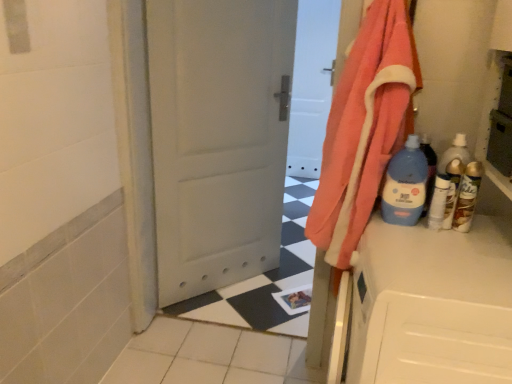
What do you see at coordinates (452, 190) in the screenshot? I see `clear plastic bottle at right, which is the second bottle in right-to-left order` at bounding box center [452, 190].

You are a GUI agent. You are given a task and a screenshot of the screen. Output one action in this format:
    pyautogui.click(x=<x>, y=<y>)
    Task: Click on the white glossy bottle at right, arranged as the 3th bottle when viewed from the right
    Image resolution: width=512 pixels, height=384 pixels.
    Given the screenshot: What is the action you would take?
    pyautogui.click(x=438, y=202)

The height and width of the screenshot is (384, 512). Identify the location of blue plastic bottle at right, placed as the 1th bottle when sorted from left to right. (405, 185).

This screenshot has width=512, height=384. Describe the element at coordinates (364, 128) in the screenshot. I see `orange cotton towel at right` at that location.

Find the location of a particular element. white matte counter top at right is located at coordinates (431, 305).

Image resolution: width=512 pixels, height=384 pixels. What do you see at coordinates (431, 305) in the screenshot?
I see `white matte counter top at right` at bounding box center [431, 305].

Locate an element on the screen. clear plastic bottle at right, which is the second bottle in right-to-left order is located at coordinates (452, 190).

Considering the relative sizes of orange cotton towel at right and clear plastic bottle at right, which is the second bottle in right-to-left order, in the image provided, is orange cotton towel at right taller than clear plastic bottle at right, which is the second bottle in right-to-left order,?

Yes.

From the picture: From the image's perspective, is orange cotton towel at right located beneath clear plastic bottle at right, the third bottle positioned from the left?

Actually, orange cotton towel at right appears above clear plastic bottle at right, the third bottle positioned from the left, in the image.

Is orange cotton towel at right bigger than clear plastic bottle at right, which is the second bottle in right-to-left order?

Yes.

What are the coordinates of `the 1st bottle positioned above the orange cotton towel at right (from a real-world perspective)` in the screenshot? It's located at (467, 196).

Which object is wider, orange cotton towel at right or gold metallic spray can at right, placed as the first bottle when sorted from right to left?

orange cotton towel at right is wider.

Considering the points (399, 72) and (455, 211), which point is behind, point (399, 72) or point (455, 211)?

Positioned behind is point (455, 211).

From a real-world perspective, which is physically above, white glossy bottle at right, arranged as the 3th bottle when viewed from the right, or clear plastic bottle at right, which is the second bottle in right-to-left order?

clear plastic bottle at right, which is the second bottle in right-to-left order, is physically above.

Is white glossy bottle at right, arranged as the 3th bottle when viewed from the right, oriented towards clear plastic bottle at right, the third bottle positioned from the left?

No, white glossy bottle at right, arranged as the 3th bottle when viewed from the right, does not turn towards clear plastic bottle at right, the third bottle positioned from the left.

Is white glossy bottle at right, the 2th bottle from the left, not near clear plastic bottle at right, which is the second bottle in right-to-left order?

No, there isn't a large distance between white glossy bottle at right, the 2th bottle from the left, and clear plastic bottle at right, which is the second bottle in right-to-left order.

Considering the positions of points (451, 178) and (434, 278), is point (451, 178) farther from camera compared to point (434, 278)?

Yes, it is.

How different are the orientations of clear plastic bottle at right, which is the second bottle in right-to-left order, and white matte counter top at right in degrees?

They differ by 89.3 degrees in their facing directions.

Locate an element on the screen. This screenshot has width=512, height=384. counter top below the clear plastic bottle at right, the third bottle positioned from the left (from a real-world perspective) is located at coordinates (431, 305).

Which is more to the right, clear plastic bottle at right, which is the second bottle in right-to-left order, or white matte counter top at right?

clear plastic bottle at right, which is the second bottle in right-to-left order, is more to the right.

Can you confirm if clear plastic bottle at right, the third bottle positioned from the left, is bigger than orange cotton towel at right?

No.

In the scene shown: Which is correct: clear plastic bottle at right, the third bottle positioned from the left, is inside orange cotton towel at right, or outside of it?

The correct answer is: outside.

What's the angular difference between clear plastic bottle at right, which is the second bottle in right-to-left order, and orange cotton towel at right's facing directions?

The angular difference between clear plastic bottle at right, which is the second bottle in right-to-left order, and orange cotton towel at right is 0.00241 degrees.

From a real-world perspective, is white matte counter top at right over gold metallic spray can at right, marked as the fourth bottle in a left-to-right arrangement?

No.

Considering the relative sizes of white matte counter top at right and gold metallic spray can at right, marked as the fourth bottle in a left-to-right arrangement, in the image provided, is white matte counter top at right wider than gold metallic spray can at right, marked as the fourth bottle in a left-to-right arrangement,?

Yes.

How distant is white matte counter top at right from gold metallic spray can at right, marked as the fourth bottle in a left-to-right arrangement?

The distance of white matte counter top at right from gold metallic spray can at right, marked as the fourth bottle in a left-to-right arrangement, is 32.48 centimeters.

Between white matte counter top at right and gold metallic spray can at right, marked as the fourth bottle in a left-to-right arrangement, which one has larger size?

white matte counter top at right.

From a real-world perspective, between white matte counter top at right and white glossy bottle at right, arranged as the 3th bottle when viewed from the right, who is vertically lower?

white matte counter top at right.

Which of these two, white matte counter top at right or white glossy bottle at right, the 2th bottle from the left, is thinner?

white glossy bottle at right, the 2th bottle from the left, is thinner.

Would you consider white matte counter top at right to be distant from white glossy bottle at right, arranged as the 3th bottle when viewed from the right?

Actually, white matte counter top at right and white glossy bottle at right, arranged as the 3th bottle when viewed from the right, are a little close together.

From a real-world perspective, which bottle is the 2nd one above the orange cotton towel at right? Please provide its 2D coordinates.

[(452, 190)]

Identify the location of the 2nd bottle behind the orange cotton towel at right. (467, 196).

Estimate the real-world distances between objects in this image. Which object is further from gold metallic spray can at right, placed as the first bottle when sorted from right to left, white matte counter top at right or orange cotton towel at right?

orange cotton towel at right.

Based on their spatial positions, is white matte counter top at right or blue plastic bottle at right, placed as the 1th bottle when sorted from left to right, further from white glossy bottle at right, the 2th bottle from the left?

white matte counter top at right is further to white glossy bottle at right, the 2th bottle from the left.

Based on their spatial positions, is orange cotton towel at right or white matte counter top at right further from clear plastic bottle at right, which is the second bottle in right-to-left order?

white matte counter top at right is positioned further to the anchor clear plastic bottle at right, which is the second bottle in right-to-left order.

From the picture: Looking at the image, which one is located closer to clear plastic bottle at right, the third bottle positioned from the left, orange cotton towel at right or blue plastic bottle at right, placed as the 4th bottle when sorted from right to left?

blue plastic bottle at right, placed as the 4th bottle when sorted from right to left, lies closer to clear plastic bottle at right, the third bottle positioned from the left, than the other object.

Which object lies further to the anchor point white matte counter top at right, orange cotton towel at right or clear plastic bottle at right, which is the second bottle in right-to-left order?

Among the two, orange cotton towel at right is located further to white matte counter top at right.

Which object lies nearer to the anchor point blue plastic bottle at right, placed as the 4th bottle when sorted from right to left, white glossy bottle at right, the 2th bottle from the left, or white matte counter top at right?

The object closer to blue plastic bottle at right, placed as the 4th bottle when sorted from right to left, is white glossy bottle at right, the 2th bottle from the left.

Based on their spatial positions, is gold metallic spray can at right, placed as the first bottle when sorted from right to left, or orange cotton towel at right further from white matte counter top at right?

Among the two, orange cotton towel at right is located further to white matte counter top at right.

From the picture: Looking at the image, which one is located further to white glossy bottle at right, the 2th bottle from the left, clear plastic bottle at right, which is the second bottle in right-to-left order, or gold metallic spray can at right, placed as the first bottle when sorted from right to left?

gold metallic spray can at right, placed as the first bottle when sorted from right to left, lies further to white glossy bottle at right, the 2th bottle from the left, than the other object.

This screenshot has width=512, height=384. What are the coordinates of `bottle between orange cotton towel at right and white glossy bottle at right, arranged as the 3th bottle when viewed from the right` in the screenshot? It's located at (405, 185).

At what (x,y) coordinates should I click in order to perform the action: click on bottle between gold metallic spray can at right, placed as the first bottle when sorted from right to left, and white matte counter top at right in the up-down direction. Please return your answer as a coordinate pair (x, y). Looking at the image, I should click on (438, 202).

What are the coordinates of `bottle between white glossy bottle at right, the 2th bottle from the left, and gold metallic spray can at right, marked as the fourth bottle in a left-to-right arrangement` in the screenshot? It's located at (452, 190).

Identify the location of bottle between blue plastic bottle at right, placed as the 1th bottle when sorted from left to right, and clear plastic bottle at right, which is the second bottle in right-to-left order, in the horizontal direction. The height and width of the screenshot is (384, 512). (438, 202).